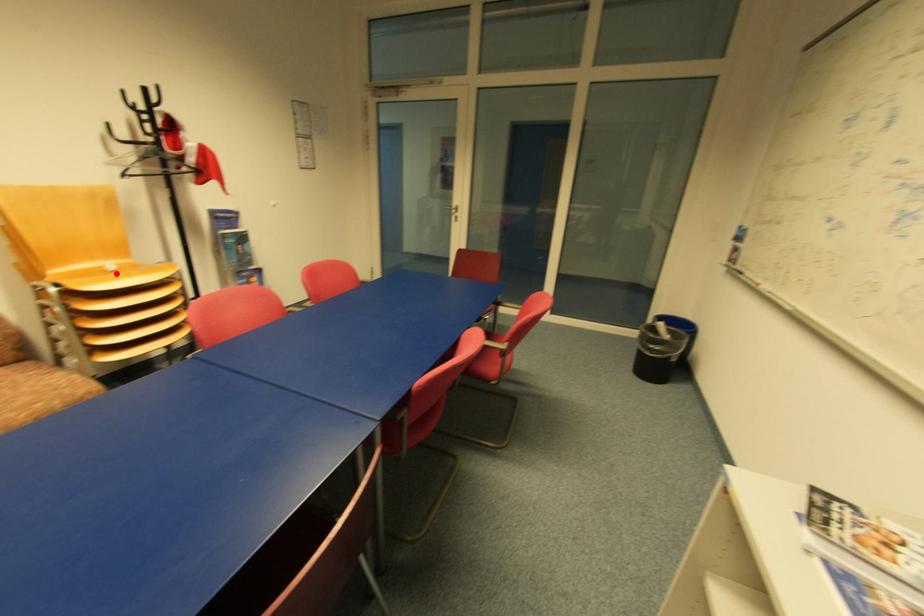
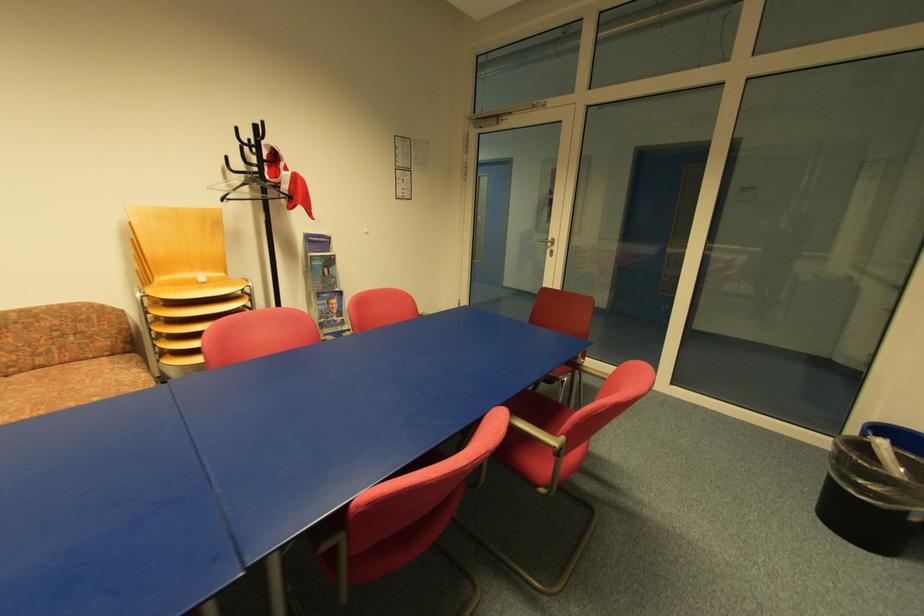
Find the pixel in the second image that matches the highlighted location in the first image.

(207, 285)